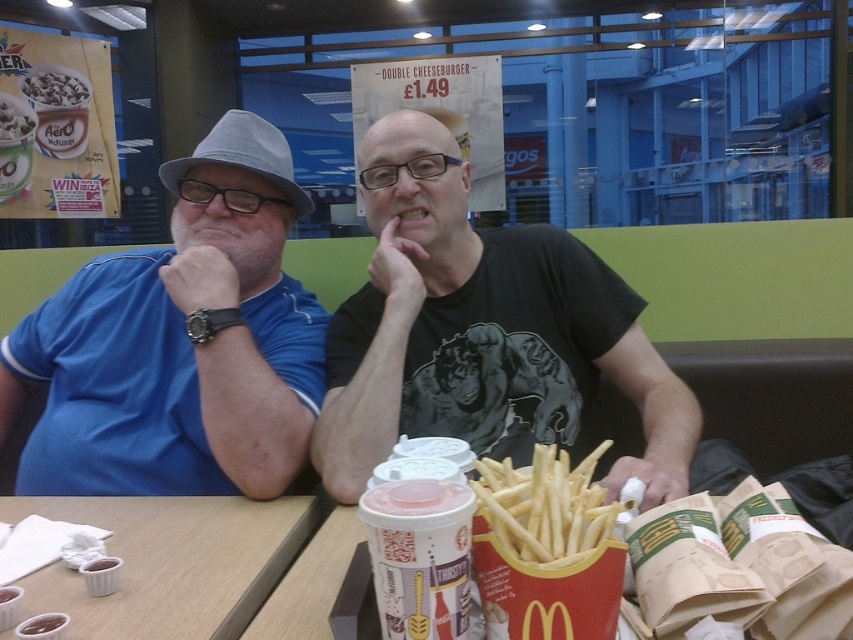
Question: Which of these objects is positioned closest to the golden crispy french fries at center?

Choices:
 (A) white frosted cup at center
 (B) thickened plastic cup at lower center
 (C) smooth white cereal at upper left
 (D) white paper cups at lower left

Answer: (B)

Question: Does blue fabric shirt at left have a larger size compared to smooth white cereal at upper left?

Choices:
 (A) no
 (B) yes

Answer: (B)

Question: Can you confirm if black matte t-shirt at center is positioned to the right of thickened plastic cup at lower center?

Choices:
 (A) no
 (B) yes

Answer: (B)

Question: Estimate the real-world distances between objects in this image. Which object is farther from the white frosted cup at center?

Choices:
 (A) white paper cups at lower left
 (B) blue fabric shirt at left
 (C) black matte t-shirt at center
 (D) golden crispy french fries at center

Answer: (D)

Question: Among these objects, which one is farthest from the camera?

Choices:
 (A) thickened plastic cup at lower center
 (B) smooth white cereal at upper left
 (C) black matte t-shirt at center

Answer: (B)

Question: Observing the image, what is the correct spatial positioning of thickened plastic cup at lower center in reference to smooth white cereal at upper left?

Choices:
 (A) below
 (B) above

Answer: (A)